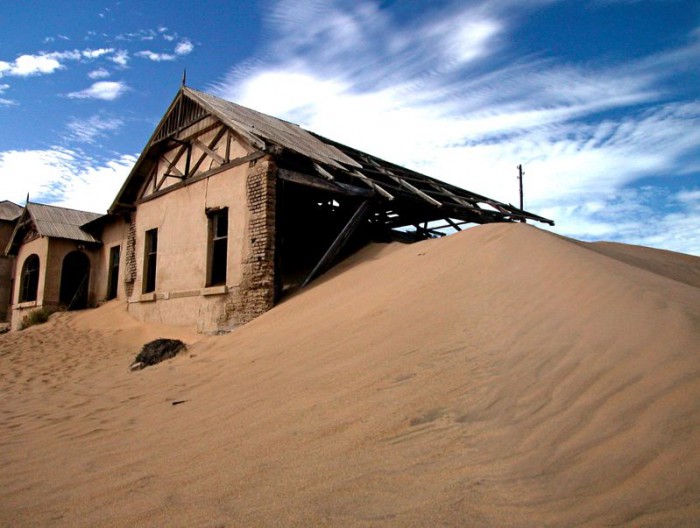
You are a GUI agent. You are given a task and a screenshot of the screen. Output one action in this format:
    pyautogui.click(x=<x>, y=<y>)
    Task: Click on the dark space of the house
    
    Given the screenshot: What is the action you would take?
    pyautogui.click(x=311, y=235)